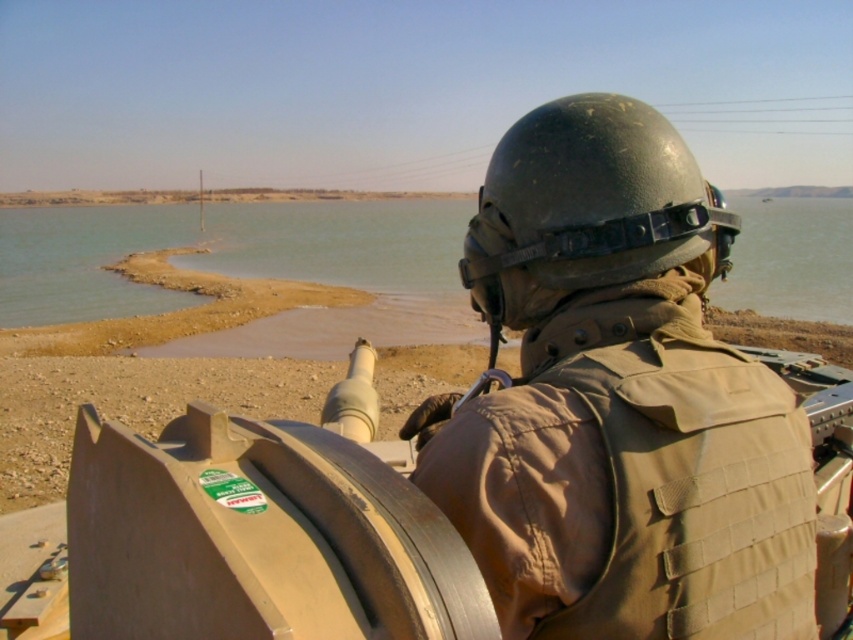
Question: Among these points, which one is nearest to the camera?

Choices:
 (A) (624, 150)
 (B) (801, 268)
 (C) (552, 452)

Answer: (C)

Question: Is matte green helmet at center below matte black helmet at center?

Choices:
 (A) no
 (B) yes

Answer: (B)

Question: Can you confirm if smooth sand at water center is positioned to the right of matte black helmet at center?

Choices:
 (A) yes
 (B) no

Answer: (B)

Question: Is matte green helmet at center further to camera compared to matte black helmet at center?

Choices:
 (A) yes
 (B) no

Answer: (B)

Question: Estimate the real-world distances between objects in this image. Which object is closer to the matte green helmet at center?

Choices:
 (A) smooth sand at water center
 (B) matte black helmet at center

Answer: (B)

Question: Which point is closer to the camera taking this photo?

Choices:
 (A) (541, 180)
 (B) (680, 625)

Answer: (B)